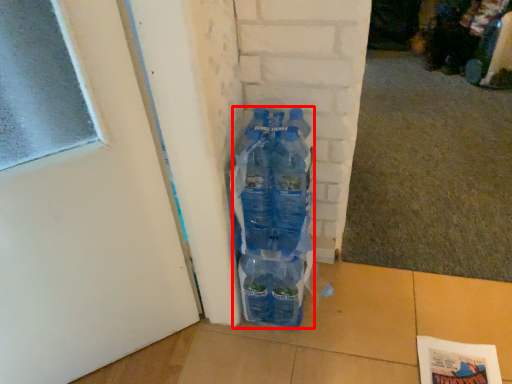
Question: From the image's perspective, considering the relative positions of bottle (annotated by the red box) and door in the image provided, where is bottle (annotated by the red box) located with respect to the staircase?

Choices:
 (A) below
 (B) above

Answer: (B)